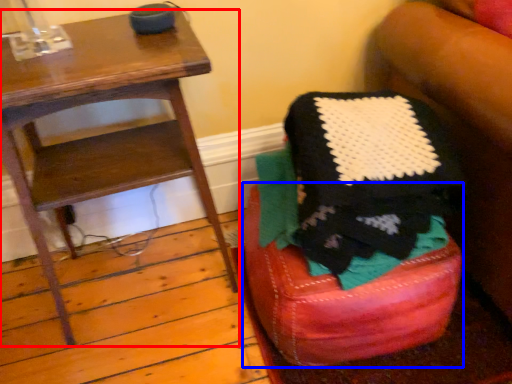
Question: Among these objects, which one is nearest to the camera, furniture (highlighted by a red box) or bar stool (highlighted by a blue box)?

Choices:
 (A) furniture
 (B) bar stool

Answer: (A)